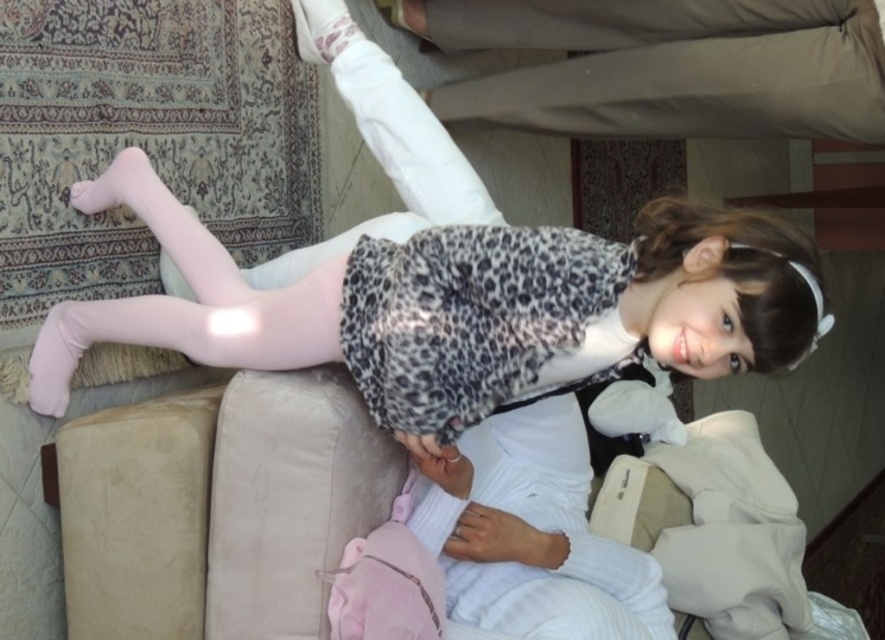
Can you confirm if matte white tights at upper center is taller than beige cotton pants at upper center?

Yes.

Find the location of a particular element. matte white tights at upper center is located at coordinates (458, 307).

Between point (470, 397) and point (686, 42), which one is positioned in front?

Point (470, 397)

This screenshot has height=640, width=885. I want to click on matte white tights at upper center, so tap(458, 307).